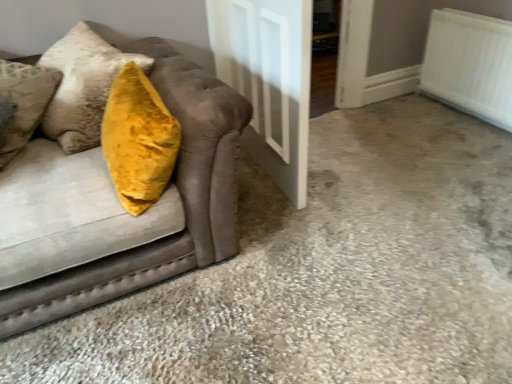
Locate an element on the screen. The height and width of the screenshot is (384, 512). white glossy door at center is located at coordinates (269, 80).

Measure the distance between white textured radiator at upper right and camera.

They are 2.32 meters apart.

Find the location of a particular element. velvet mustard pillow at left is located at coordinates (117, 198).

Find the location of `white glossy door at center`. white glossy door at center is located at coordinates (269, 80).

This screenshot has height=384, width=512. In order to click on radiator lying behind the velvet mustard pillow at left in this screenshot , I will do `click(469, 64)`.

Is white textured radiator at upper right smaller than velvet mustard pillow at left?

Yes.

Is white textured radiator at upper right taller than velvet mustard pillow at left?

Incorrect, the height of white textured radiator at upper right is not larger of that of velvet mustard pillow at left.

Is white glossy door at center oriented towards velvet mustard pillow at left?

No, white glossy door at center is not oriented towards velvet mustard pillow at left.

Does point (305, 113) come behind point (11, 286)?

Yes, point (305, 113) is behind point (11, 286).

From the image's perspective, is white glossy door at center beneath velvet mustard pillow at left?

No, from the image's perspective, white glossy door at center is not below velvet mustard pillow at left.

Is white glossy door at center bigger than velvet mustard pillow at left?

No.

Would you consider velvet mustard pillow at left to be distant from white glossy door at center?

No, velvet mustard pillow at left is not far away from white glossy door at center.

Can you confirm if velvet mustard pillow at left is shorter than white glossy door at center?

Indeed, velvet mustard pillow at left has a lesser height compared to white glossy door at center.

How different are the orientations of velvet mustard pillow at left and white glossy door at center in degrees?

There is a 84.5-degree angle between the facing directions of velvet mustard pillow at left and white glossy door at center.

Considering the positions of objects velvet mustard pillow at left and white glossy door at center in the image provided, who is more to the right, velvet mustard pillow at left or white glossy door at center?

Positioned to the right is white glossy door at center.

Is there a large distance between white textured radiator at upper right and white glossy door at center?

Yes, white textured radiator at upper right is far from white glossy door at center.

Can you confirm if white textured radiator at upper right is thinner than white glossy door at center?

Yes.

Which object is further away from the camera taking this photo, white textured radiator at upper right or white glossy door at center?

white textured radiator at upper right.

Considering the sizes of velvet mustard pillow at left and white textured radiator at upper right in the image, is velvet mustard pillow at left taller or shorter than white textured radiator at upper right?

Clearly, velvet mustard pillow at left is taller compared to white textured radiator at upper right.

From the image's perspective, relative to white textured radiator at upper right, is velvet mustard pillow at left above or below?

From the image's perspective, velvet mustard pillow at left appears below white textured radiator at upper right.

From a real-world perspective, is velvet mustard pillow at left physically below white textured radiator at upper right?

No, from a real-world perspective, velvet mustard pillow at left is not below white textured radiator at upper right.

Could white textured radiator at upper right be considered to be inside velvet mustard pillow at left?

No, white textured radiator at upper right is not a part of velvet mustard pillow at left.

Is white glossy door at center positioned far away from white textured radiator at upper right?

white glossy door at center is positioned a significant distance from white textured radiator at upper right.

Considering the positions of objects white glossy door at center and white textured radiator at upper right in the image provided, who is more to the left, white glossy door at center or white textured radiator at upper right?

From the viewer's perspective, white glossy door at center appears more on the left side.

From a real-world perspective, relative to white textured radiator at upper right, is white glossy door at center vertically above or below?

In terms of real-world spatial position, white glossy door at center is above white textured radiator at upper right.

Find the location of a particular element. The width and height of the screenshot is (512, 384). radiator behind the velvet mustard pillow at left is located at coordinates 469,64.

The width and height of the screenshot is (512, 384). Identify the location of door positioned vertically above the velvet mustard pillow at left (from a real-world perspective). (269, 80).

From the image, which object appears to be nearer to velvet mustard pillow at left, white glossy door at center or white textured radiator at upper right?

Based on the image, white glossy door at center appears to be nearer to velvet mustard pillow at left.

Based on their spatial positions, is velvet mustard pillow at left or white textured radiator at upper right further from white glossy door at center?

Based on the image, white textured radiator at upper right appears to be further to white glossy door at center.

From the image, which object appears to be nearer to white textured radiator at upper right, white glossy door at center or velvet mustard pillow at left?

white glossy door at center lies closer to white textured radiator at upper right than the other object.

In the scene shown: Estimate the real-world distances between objects in this image. Which object is further from white glossy door at center, white textured radiator at upper right or velvet mustard pillow at left?

white textured radiator at upper right is further to white glossy door at center.

Which object lies nearer to the anchor point white textured radiator at upper right, velvet mustard pillow at left or white glossy door at center?

The object closer to white textured radiator at upper right is white glossy door at center.

Which object lies further to the anchor point velvet mustard pillow at left, white textured radiator at upper right or white glossy door at center?

white textured radiator at upper right is further to velvet mustard pillow at left.

Identify the location of door between velvet mustard pillow at left and white textured radiator at upper right from left to right. The height and width of the screenshot is (384, 512). (269, 80).